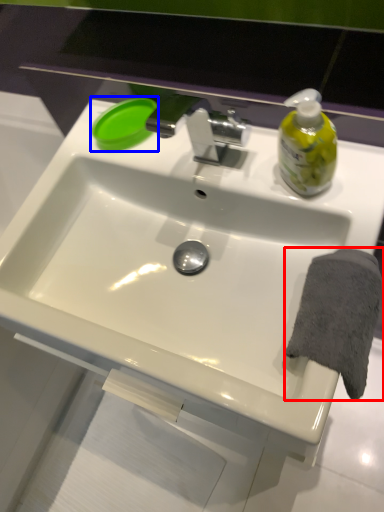
Question: Which object is closer to the camera taking this photo, bath towel (highlighted by a red box) or soap (highlighted by a blue box)?

Choices:
 (A) bath towel
 (B) soap

Answer: (A)